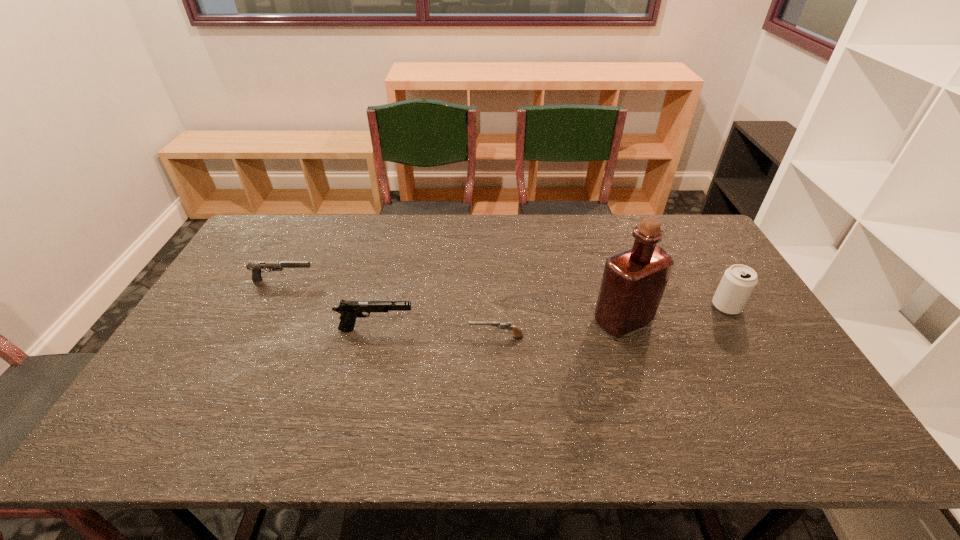
Find the location of a particular element. vacant region at the near edge is located at coordinates (192, 442).

You are a GUI agent. You are given a task and a screenshot of the screen. Output one action in this format:
    pyautogui.click(x=<x>, y=<y>)
    Task: Click on the free space at the right edge of the desktop
    The image size is (960, 540).
    Given the screenshot: What is the action you would take?
    pyautogui.click(x=694, y=280)

Identify the location of free point at the far left corner. The height and width of the screenshot is (540, 960). (256, 236).

The width and height of the screenshot is (960, 540). In the image, there is a desktop. Identify the location of vacant space at the near left corner. (117, 448).

In the image, there is a desktop. Identify the location of free space at the far right corner. The width and height of the screenshot is (960, 540). (702, 233).

This screenshot has height=540, width=960. In order to click on vacant space that's between the tallest object and the third object from left to right in this screenshot , I will do `click(560, 328)`.

Image resolution: width=960 pixels, height=540 pixels. Identify the location of vacant space in between the second farthest gun and the farthest gun. (329, 305).

Where is `free spot between the fourth shortest object and the fourth object from left to right`? free spot between the fourth shortest object and the fourth object from left to right is located at coordinates (675, 313).

Find the location of a particular element. The width and height of the screenshot is (960, 540). free spot between the fourth object from left to right and the second tallest gun is located at coordinates (453, 300).

What are the coordinates of `free space between the tallest object and the leftmost gun` in the screenshot? It's located at (x=453, y=300).